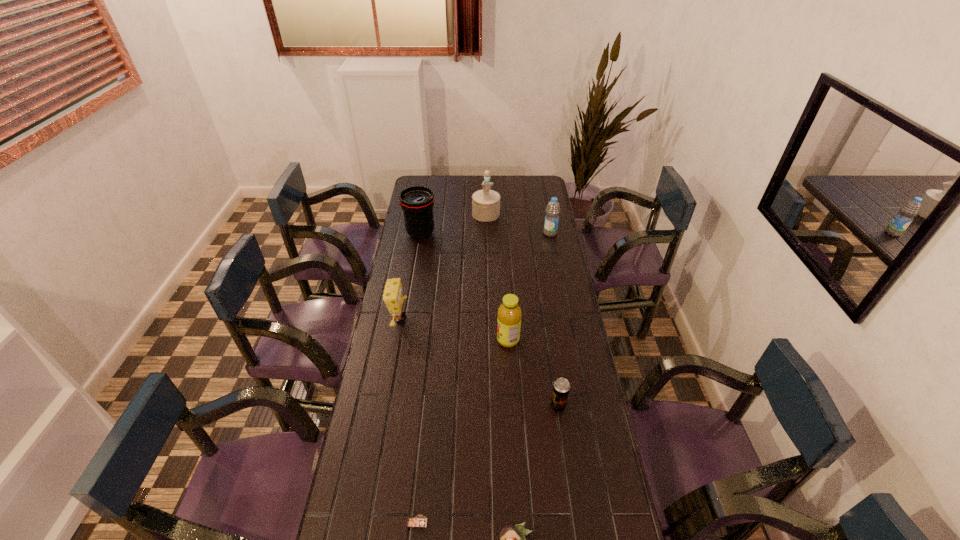
The image size is (960, 540). In order to click on free space located 0.080m on the front of the telephoto lens in this screenshot , I will do `click(418, 253)`.

Find the location of a particular element. Image resolution: width=960 pixels, height=540 pixels. vacant area situated 0.280m on the front label of the fruit juice is located at coordinates (424, 340).

Identify the location of vacant space situated 0.080m on the front label of the fruit juice. (476, 340).

Where is `vacant region located 0.050m on the front label of the fruit juice`? vacant region located 0.050m on the front label of the fruit juice is located at coordinates (484, 340).

The width and height of the screenshot is (960, 540). What are the coordinates of `free space located 0.300m on the back of the rightmost object` in the screenshot? It's located at pyautogui.click(x=543, y=198).

The height and width of the screenshot is (540, 960). In order to click on vacant point located on the face of the fourth shortest object in this screenshot , I will do [496, 319].

Identify the location of vacant area situated on the front of the beer can. (575, 522).

The image size is (960, 540). I want to click on free region located 0.290m on the right of the seventh farthest object, so click(531, 522).

Image resolution: width=960 pixels, height=540 pixels. Identify the location of telephoto lens that is at the left edge. (417, 202).

I want to click on sponge at the left edge, so click(393, 297).